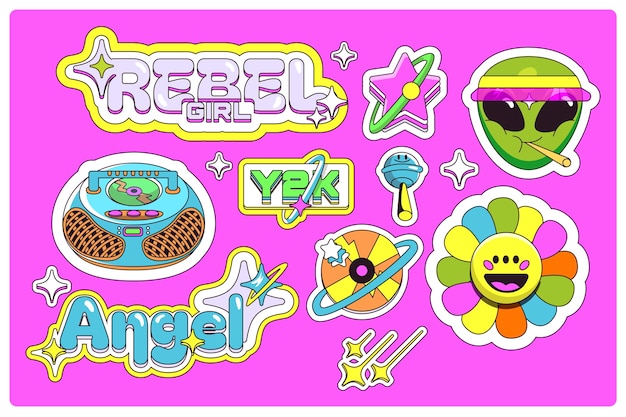
The height and width of the screenshot is (417, 626). What are the coordinates of `cd` in the screenshot? It's located at (379, 253), (146, 186).